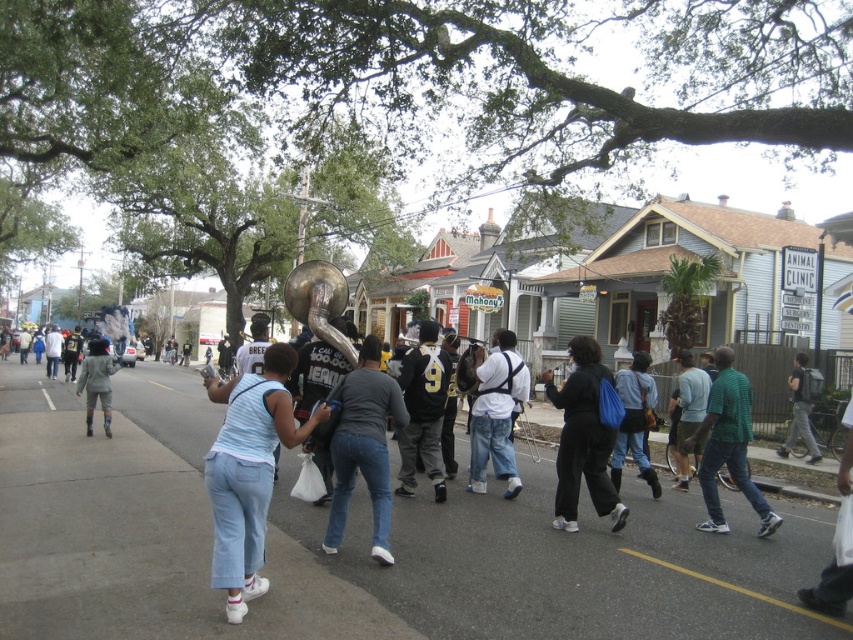
Who is more forward, (488,458) or (630,436)?

Point (630,436) is more forward.

Between point (496, 403) and point (624, 385), which one is positioned behind?

Positioned behind is point (624, 385).

Find the location of `white cotton shirt at center`. white cotton shirt at center is located at coordinates (x=496, y=413).

From the picture: Is light blue denim pants at center positioned in front of camouflage pants at center?

Yes, light blue denim pants at center is closer to the viewer.

Between light blue denim pants at center and camouflage pants at center, which one is positioned lower?

camouflage pants at center is below.

Where is `light blue denim pants at center`? light blue denim pants at center is located at coordinates (248, 472).

Where is `light blue denim pants at center`? This screenshot has width=853, height=640. light blue denim pants at center is located at coordinates (248, 472).

Is green mesh shirt at center to the right of light gray backpack at center from the viewer's perspective?

No, green mesh shirt at center is not to the right of light gray backpack at center.

Consider the image. Can you confirm if green mesh shirt at center is positioned to the left of light gray backpack at center?

Indeed, green mesh shirt at center is positioned on the left side of light gray backpack at center.

Based on the photo, who is more forward, (723,352) or (791,424)?

Positioned in front is point (723,352).

Identify the location of green mesh shirt at center. This screenshot has height=640, width=853. (728, 445).